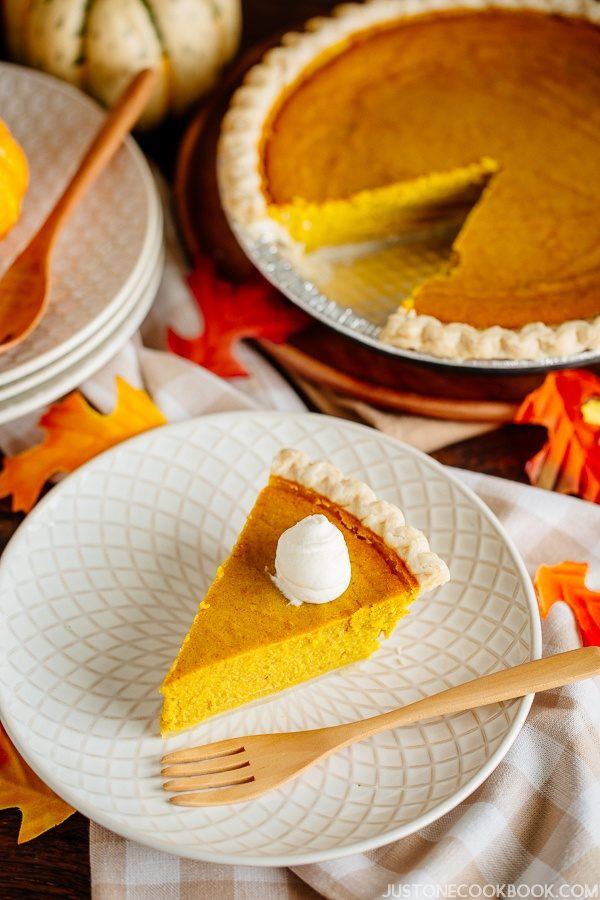
This screenshot has height=900, width=600. I want to click on plate, so click(446, 633), click(94, 275), click(48, 371), click(61, 375), click(489, 400).